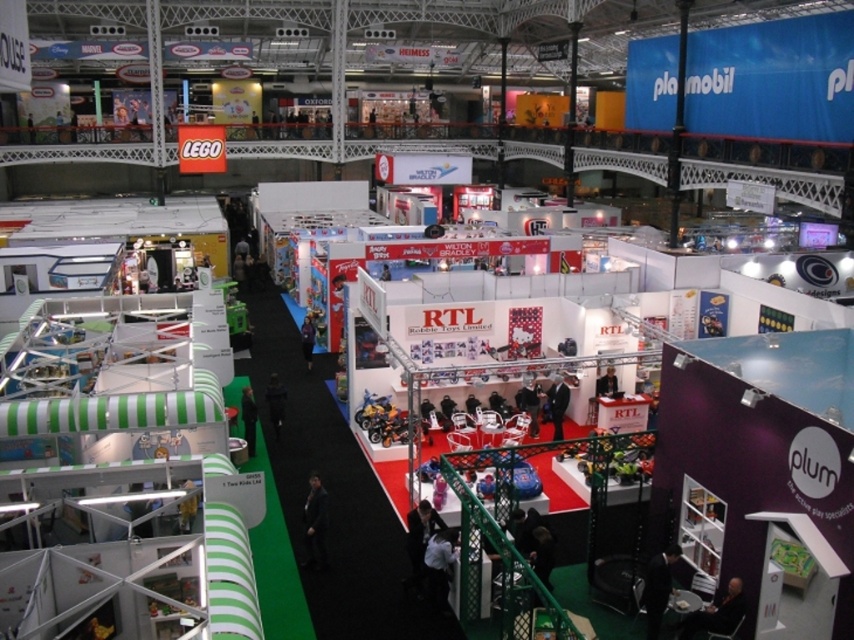
Question: Which of the following is the farthest from the observer?

Choices:
 (A) (437, 593)
 (B) (252, 413)
 (C) (525, 397)
 (D) (534, 548)

Answer: (C)

Question: Among these points, which one is nearest to the camera?

Choices:
 (A) (305, 353)
 (B) (607, 371)

Answer: (B)

Question: Can you confirm if black matte jacket at center is bigger than dark brown leather jacket at lower center?

Choices:
 (A) no
 (B) yes

Answer: (B)

Question: Considering the relative positions of white fabric at center and dark green fabric at center in the image provided, where is white fabric at center located with respect to dark green fabric at center?

Choices:
 (A) right
 (B) left

Answer: (A)

Question: Which of the following is the farthest from the observer?

Choices:
 (A) black leather jacket at center
 (B) dark brown leather jacket at lower center

Answer: (A)

Question: Considering the relative positions of white fabric at center and black fabric at center in the image provided, where is white fabric at center located with respect to black fabric at center?

Choices:
 (A) left
 (B) right

Answer: (B)